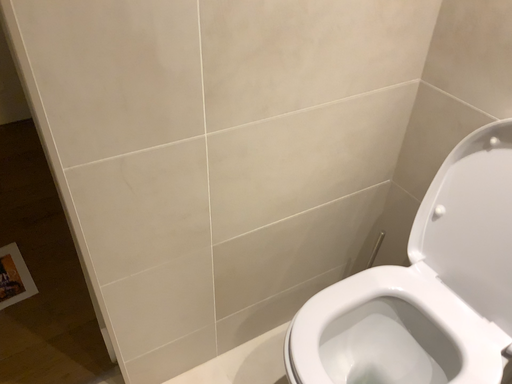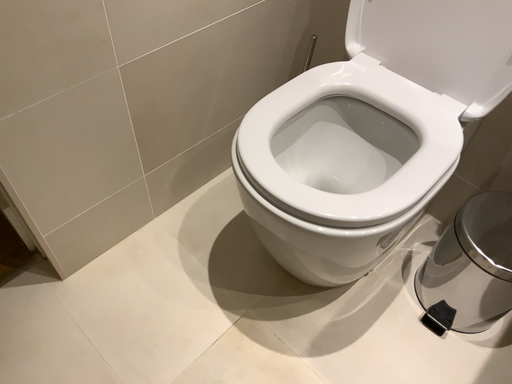
Question: How did the camera likely rotate when shooting the video?

Choices:
 (A) rotated upward
 (B) rotated downward

Answer: (B)